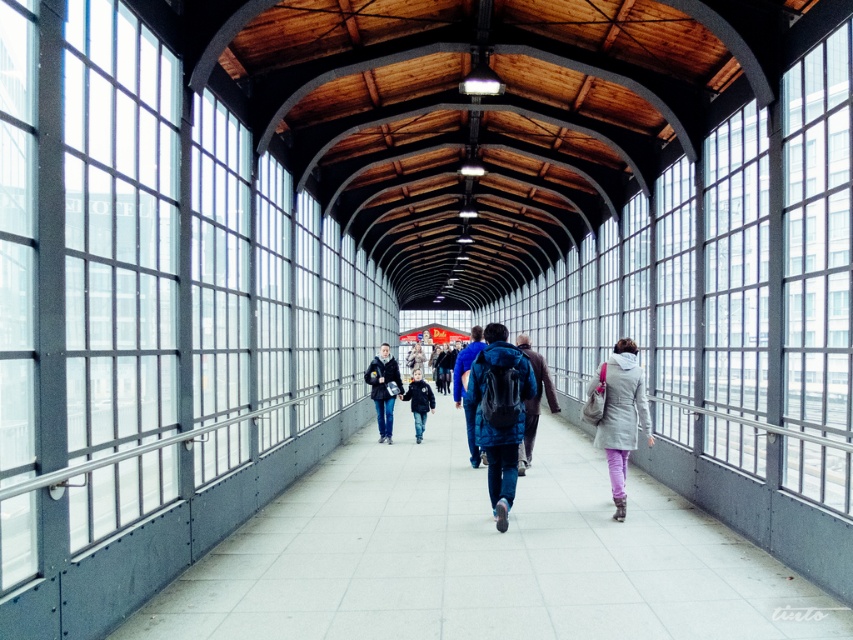
Question: Can you confirm if light gray fabric coat at center is bigger than light blue denim jacket at center?

Choices:
 (A) yes
 (B) no

Answer: (B)

Question: Does blue matte backpack at center have a smaller size compared to light blue denim jacket at center?

Choices:
 (A) yes
 (B) no

Answer: (A)

Question: Which of the following is the closest to the observer?

Choices:
 (A) (529, 454)
 (B) (421, 433)
 (C) (340, 480)
 (D) (496, 364)

Answer: (D)

Question: Is smooth concrete walkway at center bigger than light gray fabric coat at center?

Choices:
 (A) yes
 (B) no

Answer: (A)

Question: Which of the following is the farthest from the observer?

Choices:
 (A) matte black jacket at center
 (B) blue fabric backpack at center
 (C) light gray fabric coat at center
 (D) light blue denim jacket at center

Answer: (D)

Question: Which point appears farthest from the camera in this image?

Choices:
 (A) (624, 508)
 (B) (461, 353)
 (C) (451, 534)
 (D) (403, 396)

Answer: (D)